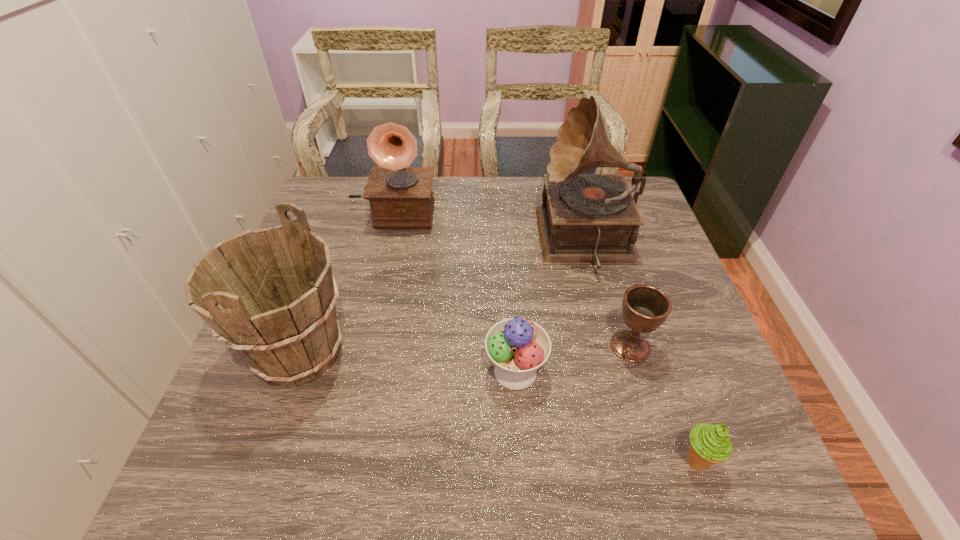
Locate an element on the screen. record player located in the right edge section of the desktop is located at coordinates (585, 219).

Where is `chalice that is at the right edge`? The width and height of the screenshot is (960, 540). chalice that is at the right edge is located at coordinates (644, 307).

The image size is (960, 540). I want to click on icecream present at the right edge, so click(710, 444).

Where is `object that is at the far left corner`? The width and height of the screenshot is (960, 540). object that is at the far left corner is located at coordinates (400, 196).

Locate an element on the screen. object at the far right corner is located at coordinates (585, 219).

This screenshot has height=540, width=960. I want to click on object situated at the near right corner, so click(x=710, y=444).

Identify the location of vacant space at the far edge. The image size is (960, 540). (468, 218).

At what (x,y) coordinates should I click in order to perform the action: click on free spot at the near edge of the desktop. Please return your answer as a coordinate pair (x, y). Looking at the image, I should click on (343, 483).

Identify the location of vacant area at the left edge. Image resolution: width=960 pixels, height=540 pixels. (353, 234).

The width and height of the screenshot is (960, 540). In the image, there is a desktop. In order to click on vacant space at the right edge in this screenshot , I will do `click(655, 342)`.